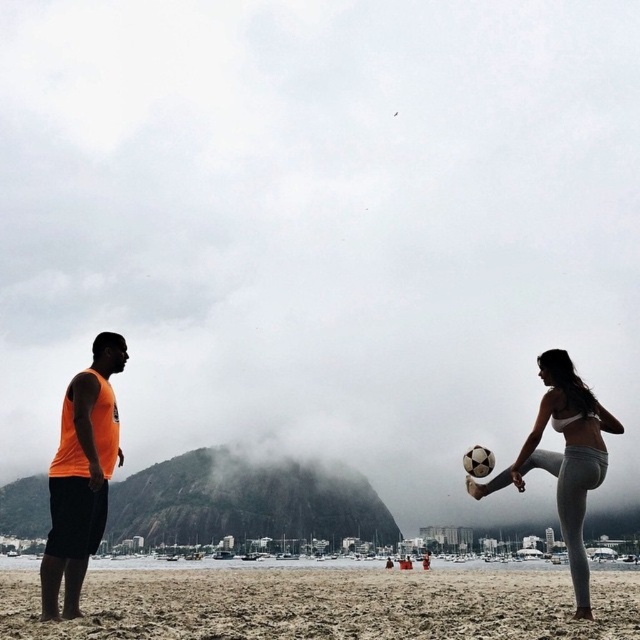
Is brown sand at lower center closer to the viewer compared to orange sleeveless shirt at left?

Yes.

From the picture: Is brown sand at lower center above orange sleeveless shirt at left?

Incorrect, brown sand at lower center is not positioned above orange sleeveless shirt at left.

Describe the element at coordinates (326, 604) in the screenshot. Image resolution: width=640 pixels, height=640 pixels. I see `brown sand at lower center` at that location.

You are a GUI agent. You are given a task and a screenshot of the screen. Output one action in this format:
    pyautogui.click(x=<x>, y=<y>)
    Task: Click on the brown sand at lower center
    Image resolution: width=640 pixels, height=640 pixels.
    Given the screenshot: What is the action you would take?
    pyautogui.click(x=326, y=604)

Does brown sand at lower center have a greater height compared to white matte bikini at center?

Yes.

Between brown sand at lower center and white matte bikini at center, which one appears on the right side from the viewer's perspective?

white matte bikini at center

I want to click on brown sand at lower center, so click(326, 604).

The image size is (640, 640). Identify the location of brown sand at lower center. (326, 604).

Measure the distance between orange sleeveless shirt at left and white matte bikini at center.

orange sleeveless shirt at left and white matte bikini at center are 56.94 meters apart.

Which is in front, point (90, 464) or point (572, 541)?

Point (90, 464) is more forward.

You are a GUI agent. You are given a task and a screenshot of the screen. Output one action in this format:
    pyautogui.click(x=<x>, y=<y>)
    Task: Click on the orange sleeveless shirt at left
    The width and height of the screenshot is (640, 640).
    Given the screenshot: What is the action you would take?
    pyautogui.click(x=81, y=476)